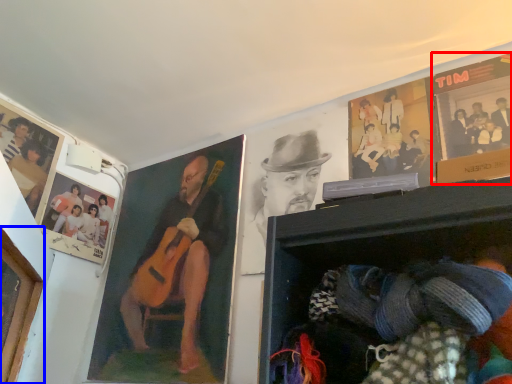
Question: Among these objects, which one is nearest to the camera, poster page (highlighted by a red box) or portrait (highlighted by a blue box)?

Choices:
 (A) poster page
 (B) portrait

Answer: (B)